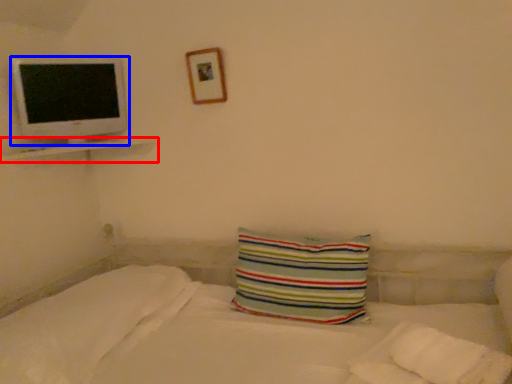
Question: Which of the following is the farthest to the observer, ledge (highlighted by a red box) or computer monitor (highlighted by a blue box)?

Choices:
 (A) ledge
 (B) computer monitor

Answer: (B)